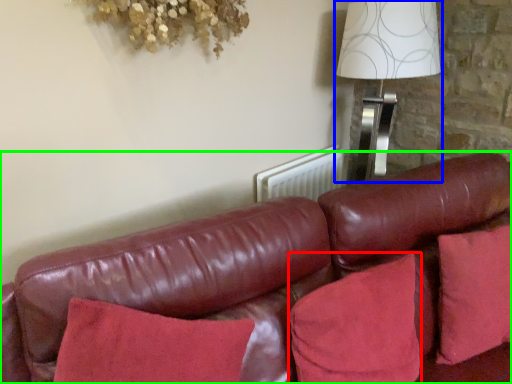
Question: Considering the real-world distances, which object is farthest from pillow (highlighted by a red box)? table lamp (highlighted by a blue box) or studio couch (highlighted by a green box)?

Choices:
 (A) table lamp
 (B) studio couch

Answer: (A)